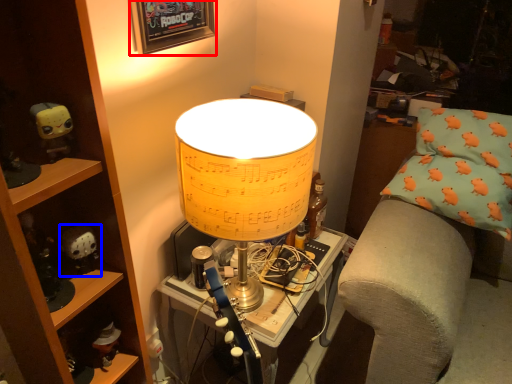
Question: Which of the following is the farthest to the observer, picture frame (highlighted by a red box) or toy (highlighted by a blue box)?

Choices:
 (A) picture frame
 (B) toy

Answer: (B)